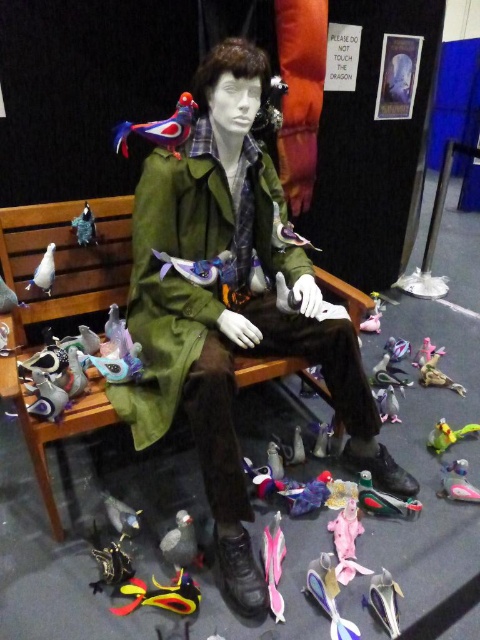
From the picture: Does silvery metallic toy at lower left have a lesser width compared to white matte seagull at left?

Incorrect, silvery metallic toy at lower left's width is not less than white matte seagull at left's.

Is silvery metallic toy at lower left above white matte seagull at left?

Actually, silvery metallic toy at lower left is below white matte seagull at left.

Is point (135, 531) positioned before point (35, 269)?

Yes, point (135, 531) is closer to viewer.

Identify the location of silvery metallic toy at lower left. (121, 515).

Who is taller, rubberized yellow and black toy at lower center or shiny blue plastic toy at lower center?

shiny blue plastic toy at lower center

Does rubberized yellow and black toy at lower center appear on the right side of shiny blue plastic toy at lower center?

No, rubberized yellow and black toy at lower center is not to the right of shiny blue plastic toy at lower center.

Locate an element on the screen. The image size is (480, 640). rubberized yellow and black toy at lower center is located at coordinates coord(160,595).

Does point (342, 552) lie behind point (94, 241)?

No, it is in front of (94, 241).

I want to click on pink fabric doll at lower center, so click(x=346, y=531).